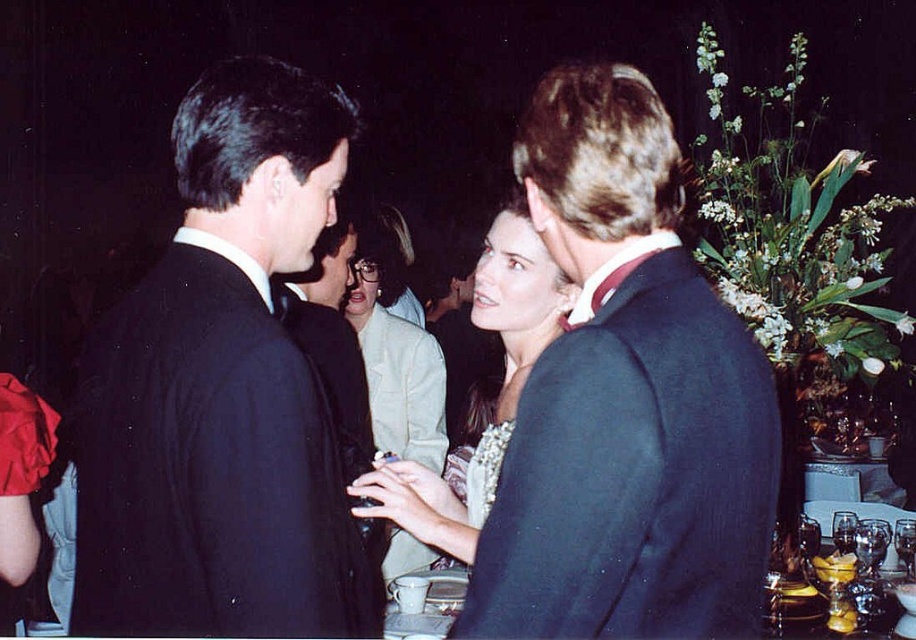
You are a photographer at the event and want to capture a closeup of both the matte black suit at left and the shiny silver necklace at center. Given their sizes, which one might require you to move closer to get a clear shot?

The matte black suit at left is smaller than the shiny silver necklace at center, so you would need to move closer to the matte black suit at left to capture it clearly.

You are a photographer at a formal event. You need to capture a photo of the dark blue wool suit at center and the shiny silver necklace at center. Which object is positioned higher in the frame?

The dark blue wool suit at center is positioned higher in the frame than the shiny silver necklace at center.

You are a photographer at a formal event. You need to arrange the two subjects wearing the matte black suit at left and dark blue wool suit at center for a group photo. Based on their current positions and attire, which subject should be positioned in the front row to ensure visibility for both?

The matte black suit at left should be placed in the front row because it has a greater height than the dark blue wool suit at center, allowing the shorter subject to be seen behind without obstruction.